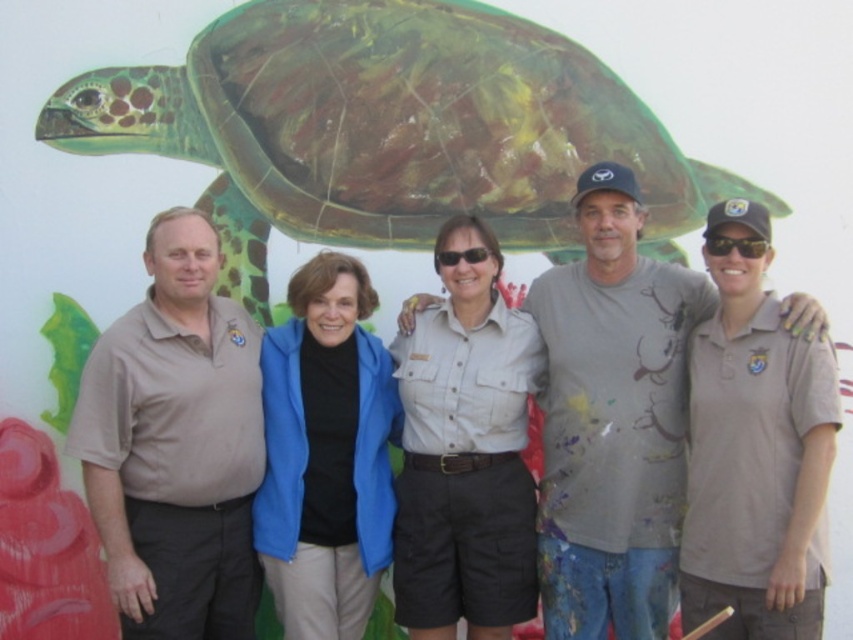
Question: Which of the following is the closest to the observer?

Choices:
 (A) matte khaki polo shirt at center
 (B) khaki uniform at center

Answer: (A)

Question: Is green painted shell at upper center positioned before khaki uniform shirt at center?

Choices:
 (A) yes
 (B) no

Answer: (B)

Question: Based on their relative distances, which object is farther from the blue fleece jacket at center?

Choices:
 (A) khaki uniform at center
 (B) brown cotton polo shirt at left
 (C) green painted shell at upper center

Answer: (C)

Question: From the image, what is the correct spatial relationship of khaki uniform at center in relation to khaki uniform shirt at center?

Choices:
 (A) below
 (B) above

Answer: (A)

Question: Observing the image, what is the correct spatial positioning of brown cotton polo shirt at left in reference to khaki uniform shirt at center?

Choices:
 (A) below
 (B) above

Answer: (A)

Question: Which point is closer to the camera?

Choices:
 (A) khaki uniform shirt at center
 (B) khaki uniform at center

Answer: (B)